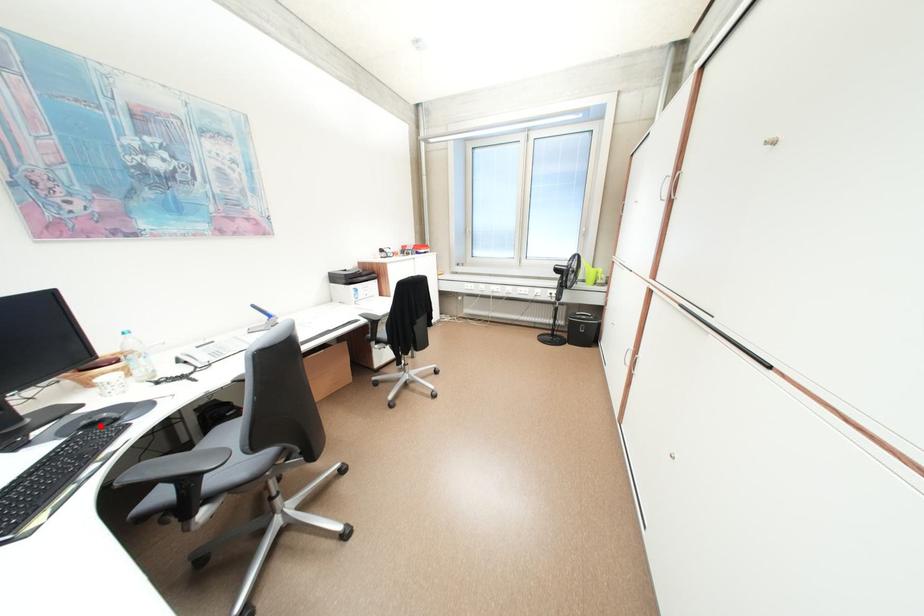
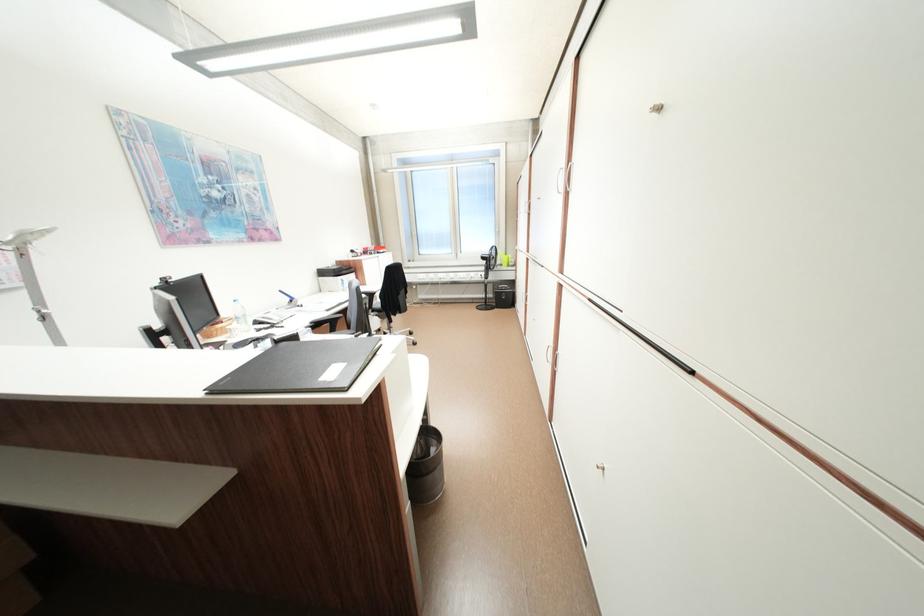
Question: I am providing you with two images of the same scene from different viewpoints. A red point is marked on the first image. Is the red point's position out of view in image 2?

Choices:
 (A) Yes
 (B) No

Answer: (A)